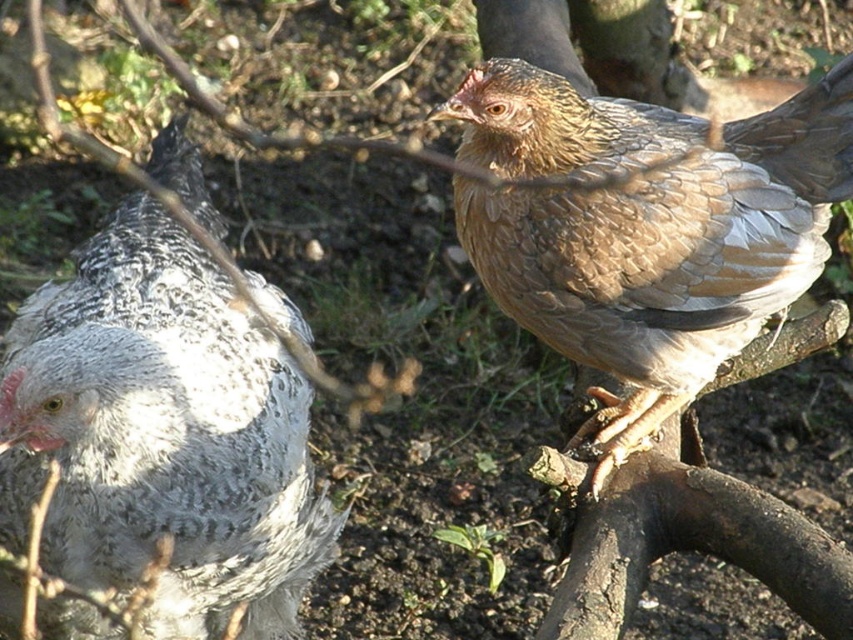
Question: Does speckled feathered chicken at left have a larger size compared to brown feathered chicken at upper right?

Choices:
 (A) yes
 (B) no

Answer: (A)

Question: From the image, what is the correct spatial relationship of speckled feathered chicken at left in relation to brown feathered chicken at upper right?

Choices:
 (A) above
 (B) below

Answer: (B)

Question: Can you confirm if speckled feathered chicken at left is bigger than brown feathered chicken at upper right?

Choices:
 (A) no
 (B) yes

Answer: (B)

Question: Which of the following is the closest to the observer?

Choices:
 (A) (207, 461)
 (B) (595, 234)

Answer: (A)

Question: Which point appears farthest from the camera in this image?

Choices:
 (A) (68, 564)
 (B) (596, 202)

Answer: (B)